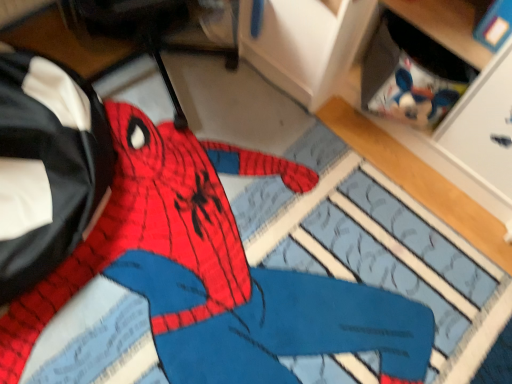
Question: From a real-world perspective, is knitted fabric spiderman at center physically located above or below black leather messenger bag at left?

Choices:
 (A) below
 (B) above

Answer: (A)

Question: Considering the positions of point (173, 216) and point (58, 71), is point (173, 216) closer or farther from the camera than point (58, 71)?

Choices:
 (A) farther
 (B) closer

Answer: (B)

Question: From the image's perspective, is knitted fabric spiderman at center located above or below black leather messenger bag at left?

Choices:
 (A) above
 (B) below

Answer: (B)

Question: Is black leather messenger bag at left to the left or to the right of knitted fabric spiderman at center in the image?

Choices:
 (A) right
 (B) left

Answer: (B)

Question: From their relative heights in the image, would you say black leather messenger bag at left is taller or shorter than knitted fabric spiderman at center?

Choices:
 (A) tall
 (B) short

Answer: (A)

Question: From the image's perspective, relative to knitted fabric spiderman at center, is black leather messenger bag at left above or below?

Choices:
 (A) below
 (B) above

Answer: (B)

Question: Is black leather messenger bag at left bigger or smaller than knitted fabric spiderman at center?

Choices:
 (A) small
 (B) big

Answer: (B)